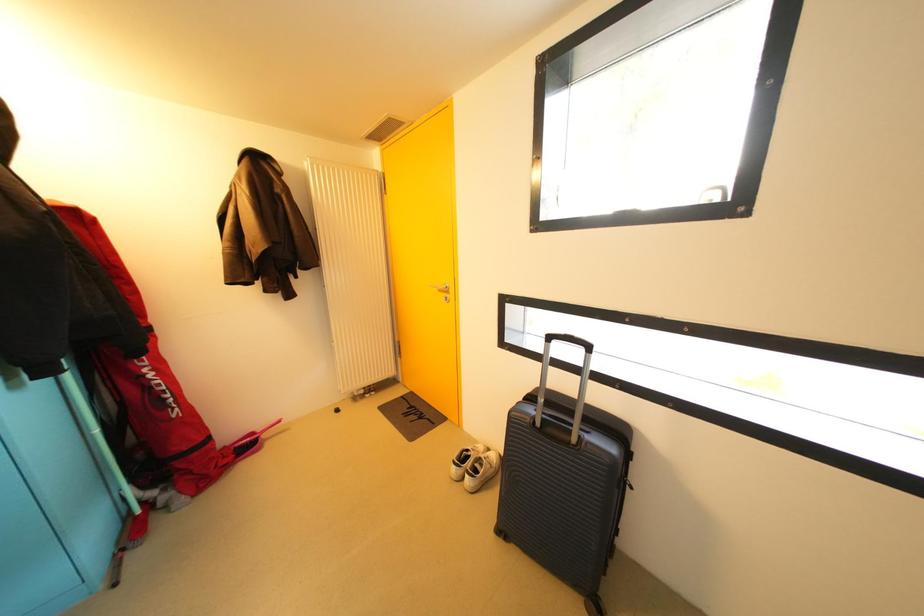
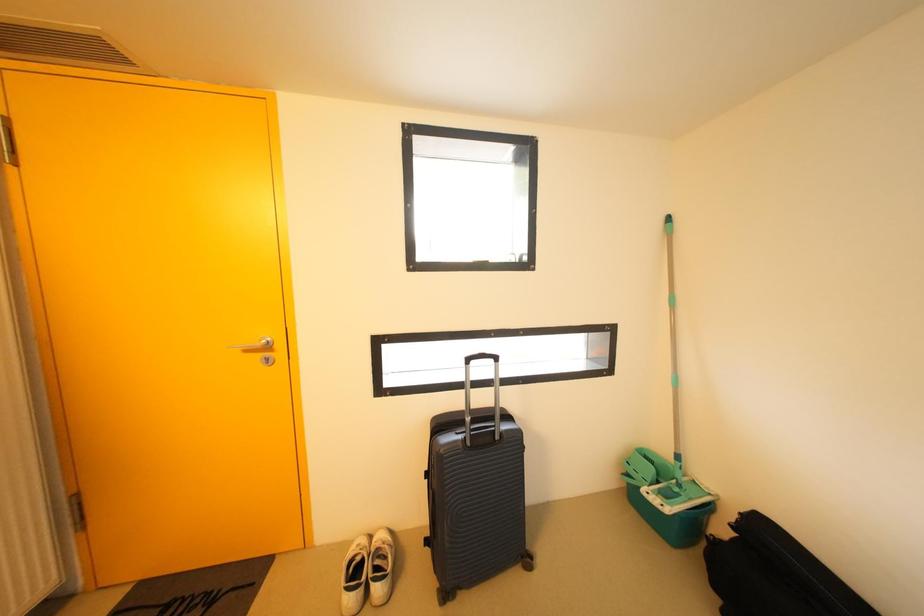
Question: The images are taken continuously from a first-person perspective. In which direction is your viewpoint rotating?

Choices:
 (A) Left
 (B) Right
 (C) Up
 (D) Down

Answer: (B)